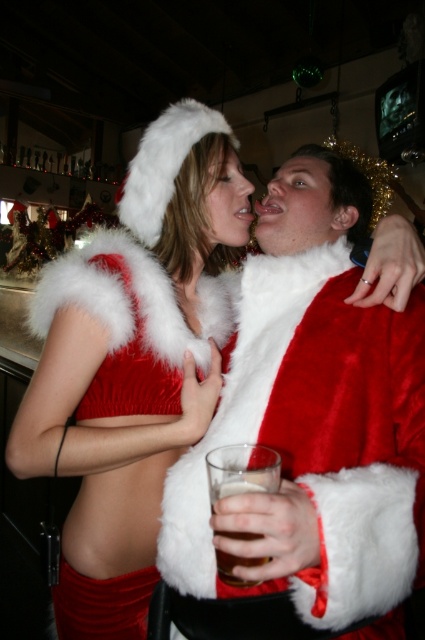
Does velvet santa coat at center have a greater width compared to velvet red dress at center?

In fact, velvet santa coat at center might be narrower than velvet red dress at center.

Is velvet santa coat at center shorter than velvet red dress at center?

Yes.

What do you see at coordinates (312, 420) in the screenshot?
I see `velvet santa coat at center` at bounding box center [312, 420].

Locate an element on the screen. The height and width of the screenshot is (640, 425). velvet santa coat at center is located at coordinates (312, 420).

Which is more to the left, velvet red dress at center or brown translucent glass at center?

From the viewer's perspective, velvet red dress at center appears more on the left side.

Which is above, velvet red dress at center or brown translucent glass at center?

Positioned higher is velvet red dress at center.

Which is in front, point (147, 564) or point (265, 561)?

Point (265, 561)

I want to click on velvet red dress at center, so click(x=133, y=362).

Looking at this image, does velvet santa coat at center appear on the right side of brown translucent glass at center?

Yes, velvet santa coat at center is to the right of brown translucent glass at center.

Does point (297, 289) come in front of point (218, 570)?

No, it is not.

Is point (317, 436) behind point (227, 566)?

Yes, point (317, 436) is behind point (227, 566).

At what (x,y) coordinates should I click in order to perform the action: click on velvet santa coat at center. Please return your answer as a coordinate pair (x, y). Looking at the image, I should click on (312, 420).